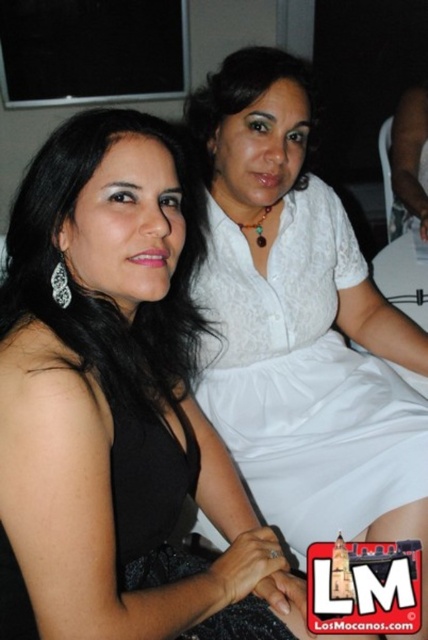
Question: In this image, where is black satin dress at left located relative to white lace dress at upper center?

Choices:
 (A) below
 (B) above

Answer: (A)

Question: Considering the real-world distances, which object is closest to the black satin dress at left?

Choices:
 (A) white lace dress at upper right
 (B) white lace dress at upper center

Answer: (A)

Question: Is black satin dress at left wider than white lace dress at upper center?

Choices:
 (A) no
 (B) yes

Answer: (B)

Question: Which point is closer to the camera?

Choices:
 (A) white lace dress at upper right
 (B) white lace dress at upper center
 (C) black satin dress at left

Answer: (C)

Question: Which object is farther from the camera taking this photo?

Choices:
 (A) white lace dress at upper center
 (B) white lace dress at upper right

Answer: (A)

Question: Is white lace dress at upper right positioned before white lace dress at upper center?

Choices:
 (A) no
 (B) yes

Answer: (B)